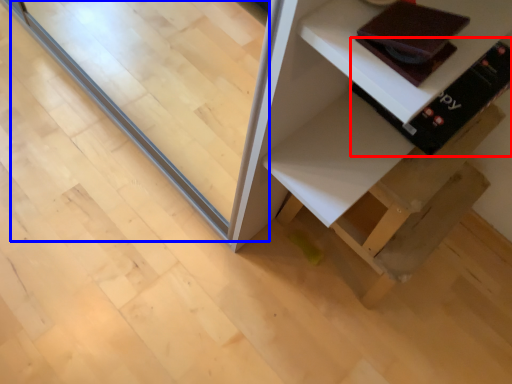
Question: Which point is further to the camera, book (highlighted by a red box) or glass door (highlighted by a blue box)?

Choices:
 (A) book
 (B) glass door

Answer: (A)